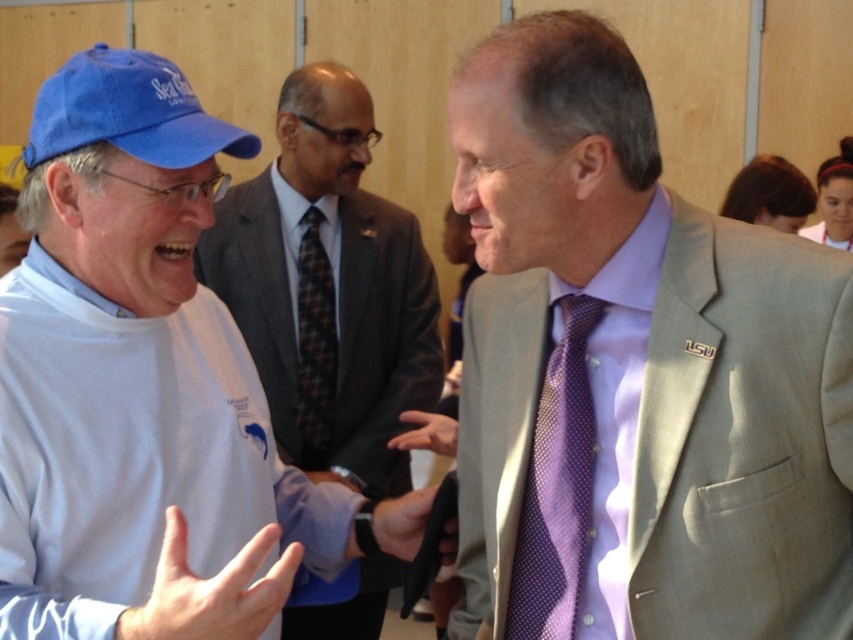
Does purple dotted tie at right lie in front of blue fabric baseball cap at left?

No, it is not.

Can you confirm if purple dotted tie at right is smaller than blue fabric baseball cap at left?

Yes.

Describe the element at coordinates (556, 486) in the screenshot. This screenshot has width=853, height=640. I see `purple dotted tie at right` at that location.

Where is `purple dotted tie at right`? purple dotted tie at right is located at coordinates (556, 486).

Locate an element on the screen. Image resolution: width=853 pixels, height=640 pixels. purple silk tie at center is located at coordinates (636, 372).

Is purple silk tie at center bigger than blue fabric baseball cap at left?

Correct, purple silk tie at center is larger in size than blue fabric baseball cap at left.

Between point (662, 435) and point (195, 115), which one is positioned in front?

Point (662, 435) is more forward.

This screenshot has width=853, height=640. Find the location of `purple silk tie at center`. purple silk tie at center is located at coordinates (636, 372).

Between point (532, 180) and point (305, 214), which one is positioned in front?

Point (532, 180)

Who is more distant from viewer, (579, 540) or (300, 433)?

Positioned behind is point (300, 433).

Who is more distant from viewer, (590,193) or (311,289)?

→ The point (311,289) is more distant.

Locate an element on the screen. The width and height of the screenshot is (853, 640). purple silk tie at center is located at coordinates (636, 372).